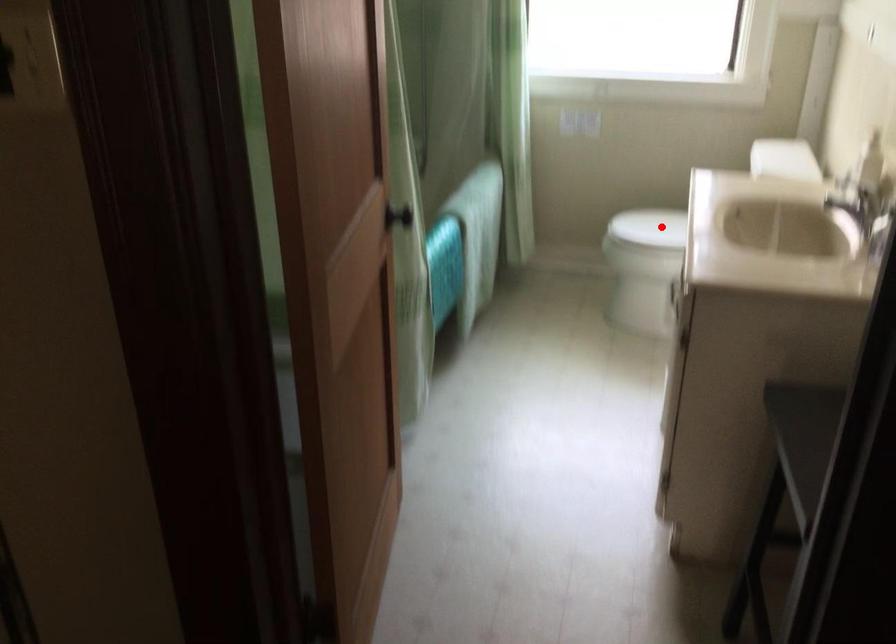
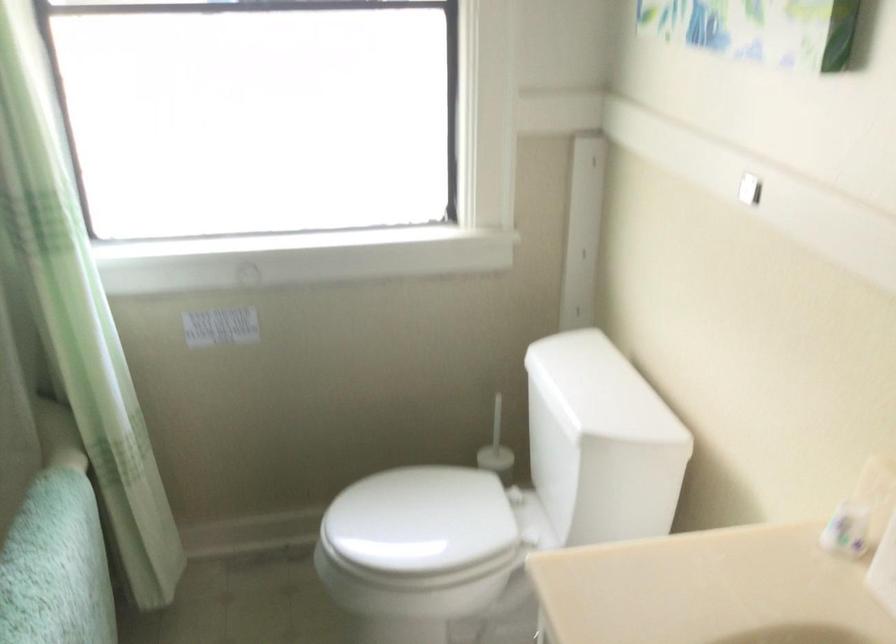
Question: I am providing you with two images of the same scene from different viewpoints. In image1, a red point is highlighted. Considering the same 3D point in image2, which of the following is correct?

Choices:
 (A) It is closer
 (B) It is farther

Answer: (A)